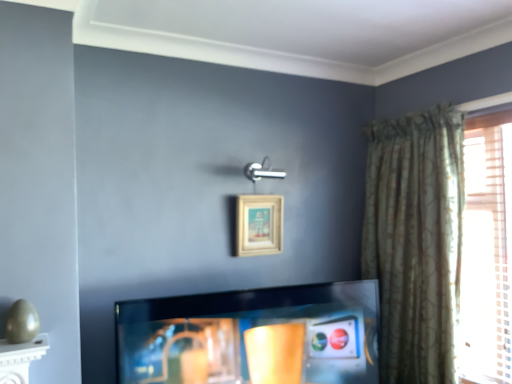
Where is `green textured curtain at right`? green textured curtain at right is located at coordinates (415, 241).

What do you see at coordinates (259, 224) in the screenshot? I see `beige wooden picture frame at upper center` at bounding box center [259, 224].

This screenshot has height=384, width=512. Identify the location of shiny black tv at center. (253, 336).

You are a GUI agent. You are given a task and a screenshot of the screen. Output one action in this format:
    pyautogui.click(x=<x>, y=<y>)
    Task: Click on the curtain that appears below the beige wooden picture frame at upper center (from a real-world perspective)
    The height and width of the screenshot is (384, 512).
    Given the screenshot: What is the action you would take?
    pyautogui.click(x=415, y=241)

Which of these two, green textured curtain at right or beige wooden picture frame at upper center, is smaller?

beige wooden picture frame at upper center.

Is green textured curtain at right in front of beige wooden picture frame at upper center?

Yes, the depth of green textured curtain at right is less than that of beige wooden picture frame at upper center.

From a real-world perspective, is green textured curtain at right physically below beige wooden picture frame at upper center?

Yes.

From the image's perspective, is shiny black tv at center below green textured curtain at right?

Yes, from the image's perspective, shiny black tv at center is beneath green textured curtain at right.

Is shiny black tv at center at the right side of green textured curtain at right?

In fact, shiny black tv at center is to the left of green textured curtain at right.

From a real-world perspective, is shiny black tv at center positioned over green textured curtain at right based on gravity?

No, from a real-world perspective, shiny black tv at center is not on top of green textured curtain at right.

Can you confirm if beige wooden picture frame at upper center is taller than shiny black tv at center?

No, beige wooden picture frame at upper center is not taller than shiny black tv at center.

Is beige wooden picture frame at upper center facing away from shiny black tv at center?

That's not correct — beige wooden picture frame at upper center is not looking away from shiny black tv at center.

Would you say beige wooden picture frame at upper center is to the left or to the right of shiny black tv at center in the picture?

In the image, beige wooden picture frame at upper center appears on the left side of shiny black tv at center.

Which object is positioned more to the right, green textured curtain at right or shiny black tv at center?

green textured curtain at right.

Which of these two, green textured curtain at right or shiny black tv at center, stands taller?

green textured curtain at right is taller.

From the image's perspective, is green textured curtain at right beneath shiny black tv at center?

Actually, green textured curtain at right appears above shiny black tv at center in the image.

Is beige wooden picture frame at upper center with green textured curtain at right?

They are not placed beside each other.

In the scene shown: Which is in front, beige wooden picture frame at upper center or green textured curtain at right?

Positioned in front is green textured curtain at right.

Is the depth of shiny black tv at center greater than that of beige wooden picture frame at upper center?

No, shiny black tv at center is in front of beige wooden picture frame at upper center.

Is shiny black tv at center not near beige wooden picture frame at upper center?

They are positioned close to each other.

At what (x,y) coordinates should I click in order to perform the action: click on television below the beige wooden picture frame at upper center (from the image's perspective). Please return your answer as a coordinate pair (x, y). Looking at the image, I should click on (253, 336).

Is shiny black tv at center positioned with its back to beige wooden picture frame at upper center?

No, shiny black tv at center is not facing away from beige wooden picture frame at upper center.

What are the coordinates of `curtain on the right of beige wooden picture frame at upper center` in the screenshot? It's located at (415, 241).

Identify the location of television below the green textured curtain at right (from a real-world perspective). This screenshot has width=512, height=384. (253, 336).

Considering their positions, is shiny black tv at center positioned closer to green textured curtain at right than beige wooden picture frame at upper center?

Among the two, shiny black tv at center is located nearer to green textured curtain at right.

Based on their spatial positions, is beige wooden picture frame at upper center or green textured curtain at right further from shiny black tv at center?

The object further to shiny black tv at center is green textured curtain at right.

From the image, which object appears to be farther from shiny black tv at center, green textured curtain at right or beige wooden picture frame at upper center?

green textured curtain at right.

When comparing their distances from beige wooden picture frame at upper center, does shiny black tv at center or green textured curtain at right seem further?

green textured curtain at right.

When comparing their distances from beige wooden picture frame at upper center, does green textured curtain at right or shiny black tv at center seem closer?

Among the two, shiny black tv at center is located nearer to beige wooden picture frame at upper center.

Which object lies nearer to the anchor point green textured curtain at right, beige wooden picture frame at upper center or shiny black tv at center?

shiny black tv at center lies closer to green textured curtain at right than the other object.

Locate an element on the screen. Image resolution: width=512 pixels, height=384 pixels. television situated between beige wooden picture frame at upper center and green textured curtain at right from left to right is located at coordinates (253, 336).